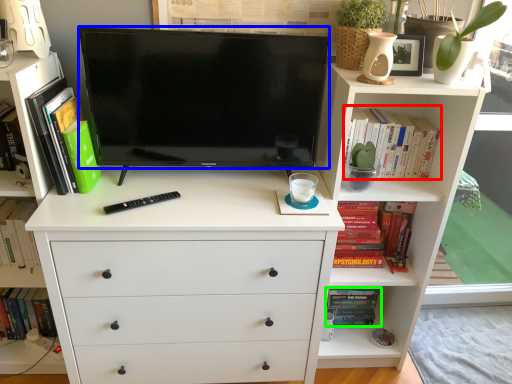
Question: Which is nearer to the book (highlighted by a red box)? television (highlighted by a blue box) or book (highlighted by a green box).

Choices:
 (A) television
 (B) book

Answer: (A)